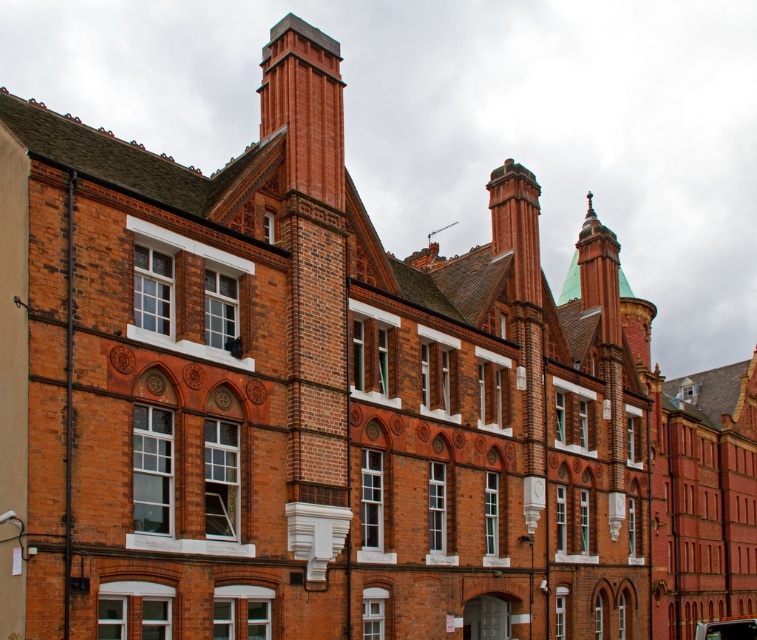
Looking at this image, you are a delivery driver who needs to park your shiny black car at bottom right close to the red brick chimney at upper center. Considering the size difference between them, can you safely park the car without blocking the chimney?

The red brick chimney at upper center is smaller than the shiny black car at bottom right. However, since the chimney is part of the building structure, you cannot park the car in a way that would block it. Ensure the car is parked nearby but does not obstruct the chimney or its access.

You are standing in front of the historic brick building. Where exactly is the brick chimney at upper center located in terms of coordinates?

The brick chimney at upper center is located at coordinates point (304, 108).